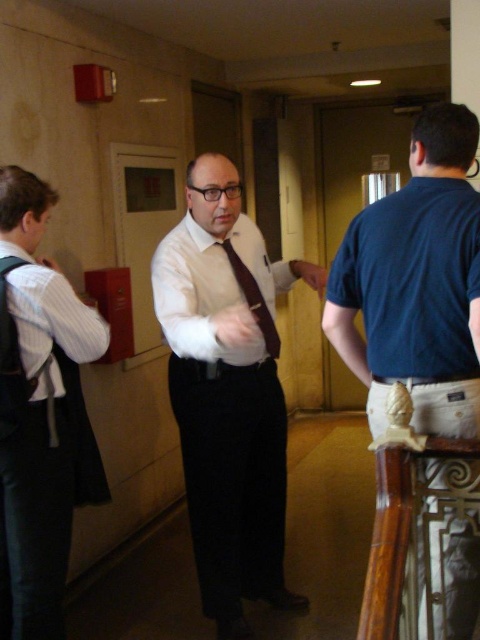
Question: Which of these objects is positioned closest to the dark blue cotton polo at right?

Choices:
 (A) brown satin tie at center
 (B) blue cotton shirt at right

Answer: (B)

Question: Which object appears farthest from the camera in this image?

Choices:
 (A) dark blue cotton polo at right
 (B) white striped shirt at left
 (C) white satin shirt at center
 (D) white glossy shirt at center

Answer: (C)

Question: Can you confirm if blue cotton shirt at right is smaller than white striped shirt at left?

Choices:
 (A) no
 (B) yes

Answer: (A)

Question: Can you confirm if blue cotton shirt at right is positioned to the right of white striped shirt at left?

Choices:
 (A) no
 (B) yes

Answer: (B)

Question: Where is white satin shirt at center located in relation to brown satin tie at center in the image?

Choices:
 (A) above
 (B) below

Answer: (A)

Question: Among these objects, which one is farthest from the camera?

Choices:
 (A) brown satin tie at center
 (B) blue cotton shirt at right

Answer: (A)